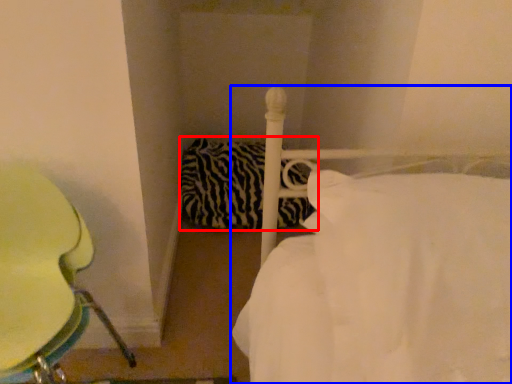
Question: Which object is further to the camera taking this photo, pillow (highlighted by a red box) or bed (highlighted by a blue box)?

Choices:
 (A) pillow
 (B) bed

Answer: (A)